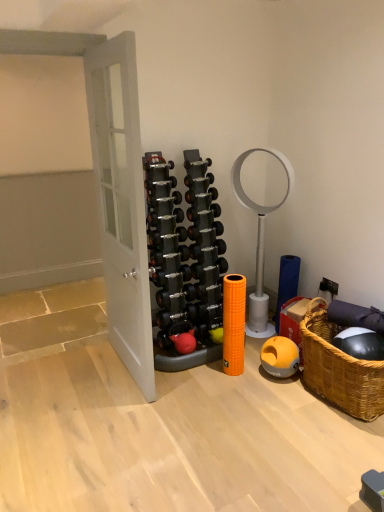
Where is `free space above orange rubber dumbbell at lower right, the 16th dumbbell from the top (from a real-world perspective)`? This screenshot has height=512, width=384. free space above orange rubber dumbbell at lower right, the 16th dumbbell from the top (from a real-world perspective) is located at coordinates (288, 339).